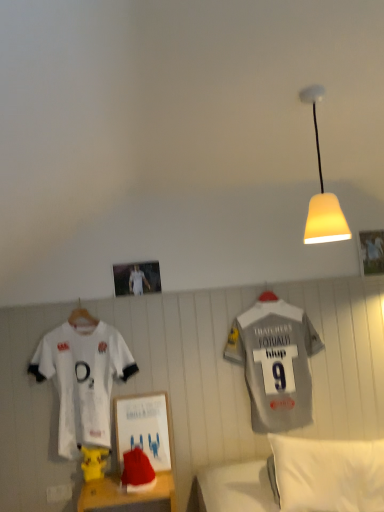
What is the approximate width of wooden table at lower center?

The width of wooden table at lower center is 13.86 inches.

This screenshot has height=512, width=384. Identify the location of white soft pillow at lower right. (329, 474).

You are a GUI agent. You are given a task and a screenshot of the screen. Output one action in this format:
    pyautogui.click(x=<x>, y=<y>)
    Task: Click on the wooden picture frame at upper right, the first picture frame viewed from the right
    
    Given the screenshot: What is the action you would take?
    pyautogui.click(x=371, y=252)

Where is `metallic silver photo frame at upper center, acting as the second picture frame starting from the back`? The width and height of the screenshot is (384, 512). metallic silver photo frame at upper center, acting as the second picture frame starting from the back is located at coordinates (136, 278).

Identify the location of wooden table at lower center. (127, 496).

What's the angular difference between wooden picture frame at upper right, the first picture frame viewed from the back, and wooden table at lower center's facing directions?

1.75 degrees separate the facing orientations of wooden picture frame at upper right, the first picture frame viewed from the back, and wooden table at lower center.

From the picture: Between wooden picture frame at upper right, the first picture frame viewed from the right, and wooden table at lower center, which one is positioned behind?

wooden picture frame at upper right, the first picture frame viewed from the right.

Is wooden picture frame at upper right, the first picture frame viewed from the back, positioned beyond the bounds of wooden table at lower center?

Yes, wooden picture frame at upper right, the first picture frame viewed from the back, is located beyond the bounds of wooden table at lower center.

Where is `the 2nd picture frame behind when counting from the wooden table at lower center`? the 2nd picture frame behind when counting from the wooden table at lower center is located at coordinates (371, 252).

Which object is positioned more to the left, yellow matte lampshade at upper right or wooden picture frame at upper right, the first picture frame viewed from the right?

Positioned to the left is yellow matte lampshade at upper right.

Is yellow matte lampshade at upper right inside or outside of wooden picture frame at upper right, placed as the 2th picture frame when sorted from left to right?

yellow matte lampshade at upper right lies outside wooden picture frame at upper right, placed as the 2th picture frame when sorted from left to right.

Is yellow matte lampshade at upper right bigger or smaller than wooden picture frame at upper right, placed as the 2th picture frame when sorted from left to right?

Considering their sizes, yellow matte lampshade at upper right takes up more space than wooden picture frame at upper right, placed as the 2th picture frame when sorted from left to right.

Is the position of yellow matte lampshade at upper right less distant than that of wooden picture frame at upper right, the first picture frame viewed from the back?

Yes, yellow matte lampshade at upper right is in front of wooden picture frame at upper right, the first picture frame viewed from the back.

Considering the sizes of objects white jersey at left, arranged as the 1th sports uniform when viewed from the left, and gray fabric sports uniform at right, which is the 2th sports uniform from left to right, in the image provided, who is thinner, white jersey at left, arranged as the 1th sports uniform when viewed from the left, or gray fabric sports uniform at right, which is the 2th sports uniform from left to right,?

gray fabric sports uniform at right, which is the 2th sports uniform from left to right.

Are white jersey at left, arranged as the 1th sports uniform when viewed from the left, and gray fabric sports uniform at right, which is the first sports uniform in right-to-left order, located far from each other?

white jersey at left, arranged as the 1th sports uniform when viewed from the left, is near gray fabric sports uniform at right, which is the first sports uniform in right-to-left order, not far away.

Considering the positions of point (97, 334) and point (260, 392), is point (97, 334) closer or farther from the camera than point (260, 392)?

Point (97, 334).

From the image's perspective, is white jersey at left, which ranks as the second sports uniform in right-to-left order, positioned above or below gray fabric sports uniform at right, which is the 2th sports uniform from left to right?

Clearly, from the image's perspective, white jersey at left, which ranks as the second sports uniform in right-to-left order, is below gray fabric sports uniform at right, which is the 2th sports uniform from left to right.

Is yellow matte pikachu at lower left aimed at yellow matte lampshade at upper right?

No, yellow matte pikachu at lower left is not facing towards yellow matte lampshade at upper right.

Choose the correct answer: Is yellow matte pikachu at lower left inside yellow matte lampshade at upper right or outside it?

yellow matte pikachu at lower left is located beyond the bounds of yellow matte lampshade at upper right.

Who is bigger, yellow matte pikachu at lower left or yellow matte lampshade at upper right?

yellow matte lampshade at upper right.

Considering the relative positions of white soft pillow at lower right and wooden table at lower center in the image provided, is white soft pillow at lower right behind wooden table at lower center?

No, white soft pillow at lower right is closer to the viewer.

From the image's perspective, is white soft pillow at lower right located above wooden table at lower center?

Yes, from the image's perspective, white soft pillow at lower right is on top of wooden table at lower center.

Considering the sizes of objects white soft pillow at lower right and wooden table at lower center in the image provided, who is shorter, white soft pillow at lower right or wooden table at lower center?

wooden table at lower center.

Is white soft pillow at lower right aimed at wooden table at lower center?

No, white soft pillow at lower right is not facing towards wooden table at lower center.

From a real-world perspective, relative to wooden picture frame at upper right, placed as the 2th picture frame when sorted from left to right, is wooden table at lower center vertically above or below?

Clearly, from a real-world perspective, wooden table at lower center is below wooden picture frame at upper right, placed as the 2th picture frame when sorted from left to right.

In terms of width, does wooden table at lower center look wider or thinner when compared to wooden picture frame at upper right, marked as the second picture frame in a front-to-back arrangement?

wooden table at lower center is wider than wooden picture frame at upper right, marked as the second picture frame in a front-to-back arrangement.

What's the angular difference between wooden table at lower center and wooden picture frame at upper right, the first picture frame viewed from the right,'s facing directions?

The angle between the facing direction of wooden table at lower center and the facing direction of wooden picture frame at upper right, the first picture frame viewed from the right, is 1.75 degrees.

This screenshot has height=512, width=384. I want to click on furniture below the wooden picture frame at upper right, the first picture frame viewed from the right (from the image's perspective), so click(127, 496).

Can you see yellow matte pikachu at lower left touching metallic silver photo frame at upper center, which ranks as the first picture frame in front-to-back order?

No, yellow matte pikachu at lower left is not beside metallic silver photo frame at upper center, which ranks as the first picture frame in front-to-back order.

Considering the relative positions of yellow matte pikachu at lower left and metallic silver photo frame at upper center, the first picture frame from the left, in the image provided, is yellow matte pikachu at lower left behind metallic silver photo frame at upper center, the first picture frame from the left,?

No, it is in front of metallic silver photo frame at upper center, the first picture frame from the left.

Locate an element on the screen. This screenshot has height=512, width=384. toy below the metallic silver photo frame at upper center, which ranks as the first picture frame in front-to-back order (from the image's perspective) is located at coordinates (93, 462).

Is yellow matte pikachu at lower left oriented towards metallic silver photo frame at upper center, which ranks as the first picture frame in front-to-back order?

No, yellow matte pikachu at lower left is not aimed at metallic silver photo frame at upper center, which ranks as the first picture frame in front-to-back order.

Identify the location of furniture below the wooden picture frame at upper right, the first picture frame viewed from the back (from the image's perspective). This screenshot has width=384, height=512. (127, 496).

The height and width of the screenshot is (512, 384). I want to click on picture frame that is the 2nd one when counting backward from the yellow matte lampshade at upper right, so click(371, 252).

When comparing their distances from white soft pillow at lower right, does wooden table at lower center or white jersey at left, arranged as the 1th sports uniform when viewed from the left, seem further?

Among the two, white jersey at left, arranged as the 1th sports uniform when viewed from the left, is located further to white soft pillow at lower right.

Considering their positions, is wooden table at lower center positioned further to white soft pillow at lower right than yellow matte lampshade at upper right?

yellow matte lampshade at upper right lies further to white soft pillow at lower right than the other object.

From the picture: Considering their positions, is white jersey at left, which ranks as the second sports uniform in right-to-left order, positioned further to gray fabric sports uniform at right, which is the first sports uniform in right-to-left order, than yellow matte pikachu at lower left?

yellow matte pikachu at lower left lies further to gray fabric sports uniform at right, which is the first sports uniform in right-to-left order, than the other object.

Which object lies nearer to the anchor point yellow matte pikachu at lower left, metallic silver photo frame at upper center, which ranks as the first picture frame in front-to-back order, or white soft pillow at lower right?

Among the two, metallic silver photo frame at upper center, which ranks as the first picture frame in front-to-back order, is located nearer to yellow matte pikachu at lower left.

Based on their spatial positions, is white jersey at left, arranged as the 1th sports uniform when viewed from the left, or yellow matte pikachu at lower left further from white soft pillow at lower right?

white jersey at left, arranged as the 1th sports uniform when viewed from the left, is further to white soft pillow at lower right.

Considering their positions, is wooden picture frame at upper right, the first picture frame viewed from the right, positioned closer to metallic silver photo frame at upper center, acting as the second picture frame starting from the back, than white jersey at left, which ranks as the second sports uniform in right-to-left order?

white jersey at left, which ranks as the second sports uniform in right-to-left order, lies closer to metallic silver photo frame at upper center, acting as the second picture frame starting from the back, than the other object.

Based on their spatial positions, is metallic silver photo frame at upper center, acting as the second picture frame starting from the back, or gray fabric sports uniform at right, which is the 2th sports uniform from left to right, closer to white soft pillow at lower right?

gray fabric sports uniform at right, which is the 2th sports uniform from left to right, lies closer to white soft pillow at lower right than the other object.

Which object lies nearer to the anchor point metallic silver photo frame at upper center, the first picture frame from the left, white soft pillow at lower right or white jersey at left, arranged as the 1th sports uniform when viewed from the left?

Among the two, white jersey at left, arranged as the 1th sports uniform when viewed from the left, is located nearer to metallic silver photo frame at upper center, the first picture frame from the left.

This screenshot has height=512, width=384. Find the location of `toy between white jersey at left, which ranks as the second sports uniform in right-to-left order, and wooden table at lower center vertically`. toy between white jersey at left, which ranks as the second sports uniform in right-to-left order, and wooden table at lower center vertically is located at coordinates (93, 462).

At what (x,y) coordinates should I click in order to perform the action: click on sports uniform between yellow matte pikachu at lower left and wooden picture frame at upper right, the first picture frame viewed from the right, in the horizontal direction. Please return your answer as a coordinate pair (x, y). The width and height of the screenshot is (384, 512). Looking at the image, I should click on (275, 362).

At what (x,y) coordinates should I click in order to perform the action: click on furniture located between yellow matte pikachu at lower left and white soft pillow at lower right in the left-right direction. Please return your answer as a coordinate pair (x, y). The image size is (384, 512). Looking at the image, I should click on (127, 496).

Where is `pillow between white jersey at left, arranged as the 1th sports uniform when viewed from the left, and wooden picture frame at upper right, the first picture frame viewed from the back, in the horizontal direction`? pillow between white jersey at left, arranged as the 1th sports uniform when viewed from the left, and wooden picture frame at upper right, the first picture frame viewed from the back, in the horizontal direction is located at coordinates (329, 474).